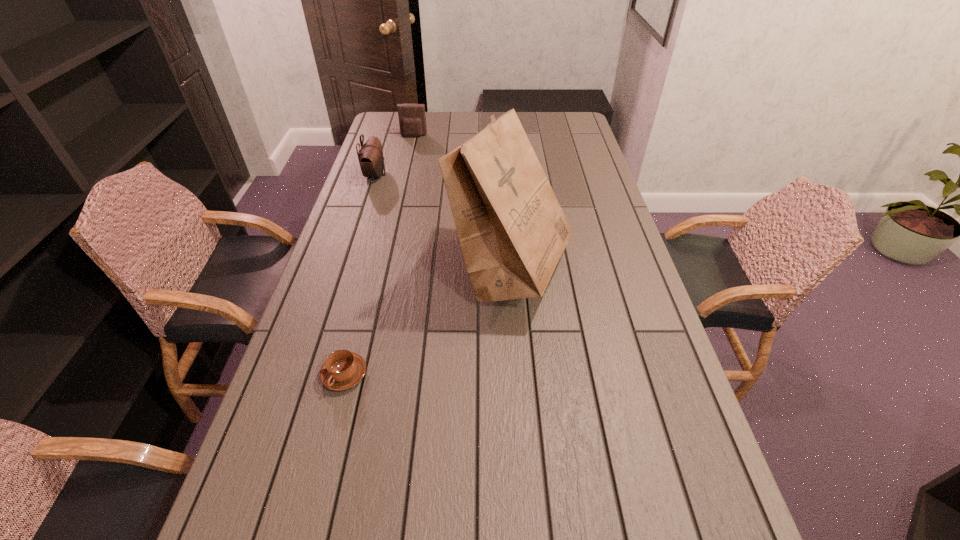
Locate an element on the screen. vacant area that lies between the right pouch and the third nearest object is located at coordinates (395, 156).

This screenshot has height=540, width=960. Find the location of `free space between the nearest object and the right pouch`. free space between the nearest object and the right pouch is located at coordinates (379, 255).

This screenshot has height=540, width=960. Find the location of `empty space between the cappuccino and the farthest object`. empty space between the cappuccino and the farthest object is located at coordinates (379, 255).

Locate an element on the screen. free spot between the second farthest object and the tallest object is located at coordinates [443, 222].

Identify the location of vacant area that lies between the grocery bag and the nearest object. (427, 322).

Where is `free space between the cappuccino and the left pouch`? The width and height of the screenshot is (960, 540). free space between the cappuccino and the left pouch is located at coordinates (360, 275).

Locate an element on the screen. The image size is (960, 540). free point between the rightmost object and the nearer pouch is located at coordinates (443, 222).

Point out which object is positioned as the third nearest to the second farthest object. Please provide its 2D coordinates. Your answer should be formatted as a tuple, i.e. [(x, y)], where the tuple contains the x and y coordinates of a point satisfying the conditions above.

[(342, 370)]

Where is `the second closest object to the third farthest object`? the second closest object to the third farthest object is located at coordinates (370, 156).

Identify the location of free spot that satisfies the following two spatial constraints: 1. with an open flap on the farthest object; 2. on the left side of the rightmost object. (383, 269).